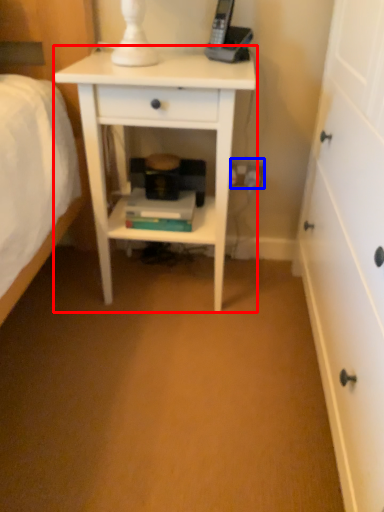
Question: Which object is closer to the camera taking this photo, nightstand (highlighted by a red box) or electric outlet (highlighted by a blue box)?

Choices:
 (A) nightstand
 (B) electric outlet

Answer: (A)